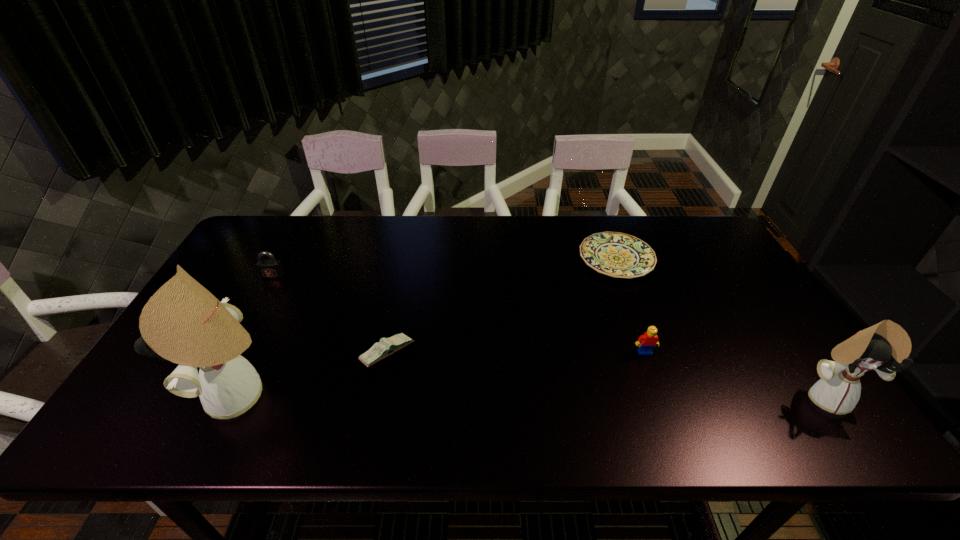
This screenshot has height=540, width=960. What are the coordinates of `the tallest object` in the screenshot? It's located at (182, 322).

Locate an element on the screen. Image resolution: width=960 pixels, height=540 pixels. the taller doll is located at coordinates (182, 322).

Where is `the second tallest object`? the second tallest object is located at coordinates (882, 347).

Locate an element on the screen. The image size is (960, 540). the rightmost object is located at coordinates (882, 347).

Locate an element on the screen. The width and height of the screenshot is (960, 540). padlock is located at coordinates (271, 268).

I want to click on the shortest object, so pos(619,255).

What are the coordinates of `Lego` in the screenshot? It's located at (647, 342).

At what (x,y) coordinates should I click in order to perform the action: click on the third object from left to right. Please return your answer as a coordinate pair (x, y). The image size is (960, 540). Looking at the image, I should click on (387, 346).

This screenshot has height=540, width=960. I want to click on the fifth tallest object, so click(387, 346).

At what (x,y) coordinates should I click in order to perform the action: click on free region located at the front face of the left doll. Please return your answer as a coordinate pair (x, y). This screenshot has width=960, height=540. Looking at the image, I should click on (182, 395).